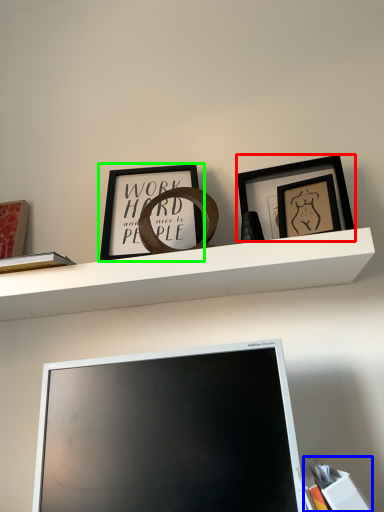
Question: Which object is positioned closest to picture frame (highlighted by a red box)? Select from book (highlighted by a blue box) and picture frame (highlighted by a green box).

Choices:
 (A) book
 (B) picture frame

Answer: (B)